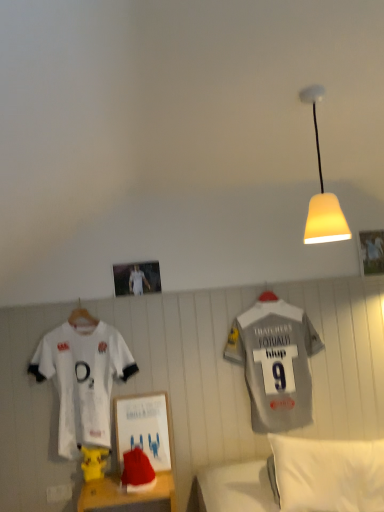
Question: From the image's perspective, is wooden picture frame at upper right, placed as the 2th picture frame when sorted from left to right, located above or below yellow matte lampshade at upper right?

Choices:
 (A) above
 (B) below

Answer: (B)

Question: Is point (369, 250) positioned closer to the camera than point (347, 236)?

Choices:
 (A) farther
 (B) closer

Answer: (A)

Question: Estimate the real-world distances between objects in this image. Which object is farther from the yellow matte pikachu at lower left?

Choices:
 (A) wooden picture frame at upper right, marked as the second picture frame in a front-to-back arrangement
 (B) wooden table at lower center
 (C) white jersey at left, which ranks as the second sports uniform in right-to-left order
 (D) gray fabric sports uniform at right, which is the first sports uniform in right-to-left order
 (E) metallic silver photo frame at upper center, acting as the second picture frame starting from the back

Answer: (A)

Question: Which object is positioned closest to the yellow matte lampshade at upper right?

Choices:
 (A) metallic silver photo frame at upper center, arranged as the second picture frame when viewed from the right
 (B) gray fabric sports uniform at right, which is the 2th sports uniform from left to right
 (C) white soft pillow at lower right
 (D) wooden table at lower center
 (E) wooden picture frame at upper right, the first picture frame viewed from the right

Answer: (C)